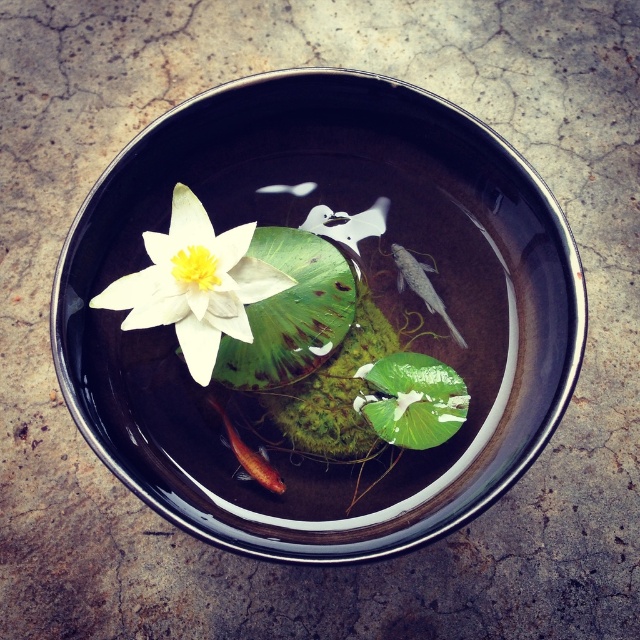
Question: Is black glossy bowl at center bigger than white matte flower at center?

Choices:
 (A) no
 (B) yes

Answer: (B)

Question: Which of the following is the closest to the observer?

Choices:
 (A) (189, 369)
 (B) (387, 545)
 (C) (253, 470)
 (D) (445, 314)

Answer: (B)

Question: Which point is farther from the camera taking this photo?

Choices:
 (A) (156, 308)
 (B) (417, 275)

Answer: (B)

Question: Does black glossy bowl at center appear on the right side of silvery metallic fish at center?

Choices:
 (A) yes
 (B) no

Answer: (B)

Question: Does black glossy bowl at center appear over silvery metallic fish at center?

Choices:
 (A) no
 (B) yes

Answer: (A)

Question: Based on their relative distances, which object is farther from the white matte flower at center?

Choices:
 (A) silvery metallic fish at center
 (B) shiny orange fish at center

Answer: (A)